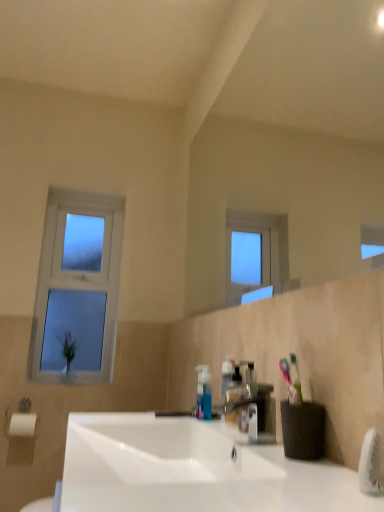
Question: From a real-world perspective, is matte plastic tap at center physically located above or below clear glass window at left?

Choices:
 (A) below
 (B) above

Answer: (A)

Question: Is point (273, 426) positioned closer to the camera than point (54, 197)?

Choices:
 (A) farther
 (B) closer

Answer: (B)

Question: Considering the real-world distances, which object is farthest from the clear glass window at left?

Choices:
 (A) white glossy sink at center
 (B) matte plastic tap at center

Answer: (B)

Question: Considering the real-world distances, which object is closest to the white glossy sink at center?

Choices:
 (A) clear glass window at left
 (B) matte plastic tap at center

Answer: (B)